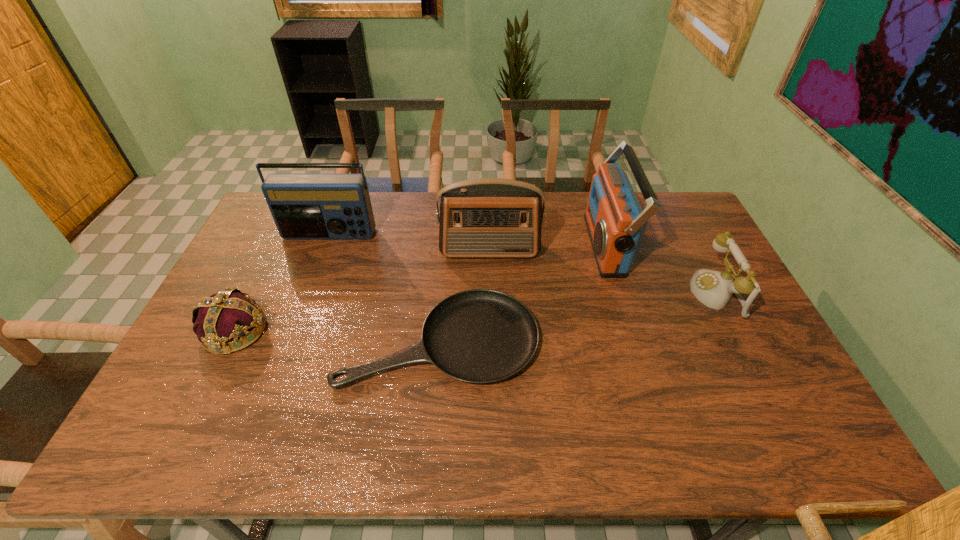
I want to click on the rightmost radio receiver, so click(x=616, y=224).

This screenshot has height=540, width=960. In order to click on the leftmost radio receiver in this screenshot , I will do `click(304, 206)`.

Where is `the second radio receiver from right to left`? The image size is (960, 540). the second radio receiver from right to left is located at coordinates (488, 217).

Identify the location of telephone. (714, 289).

Locate an element on the screen. crown is located at coordinates (223, 317).

At what (x,y) coordinates should I click in order to perform the action: click on frying pan. Please return your answer as a coordinate pair (x, y). This screenshot has width=960, height=540. Looking at the image, I should click on (478, 336).

You are a GUI agent. You are given a task and a screenshot of the screen. Output one action in this format:
    pyautogui.click(x=<x>, y=<y>)
    Task: Click on the free spot located 0.050m on the front-facing side of the rightmost radio receiver
    This screenshot has height=540, width=960.
    Given the screenshot: What is the action you would take?
    pyautogui.click(x=573, y=245)

This screenshot has height=540, width=960. Identify the location of vacant point located on the front-facing side of the rightmost radio receiver. (470, 245).

Where is `free point located 0.130m on the front-facing side of the rightmost radio receiver`? free point located 0.130m on the front-facing side of the rightmost radio receiver is located at coordinates (550, 245).

Identify the location of blank space located 0.120m on the front panel of the leftmost radio receiver. The image size is (960, 540). (317, 268).